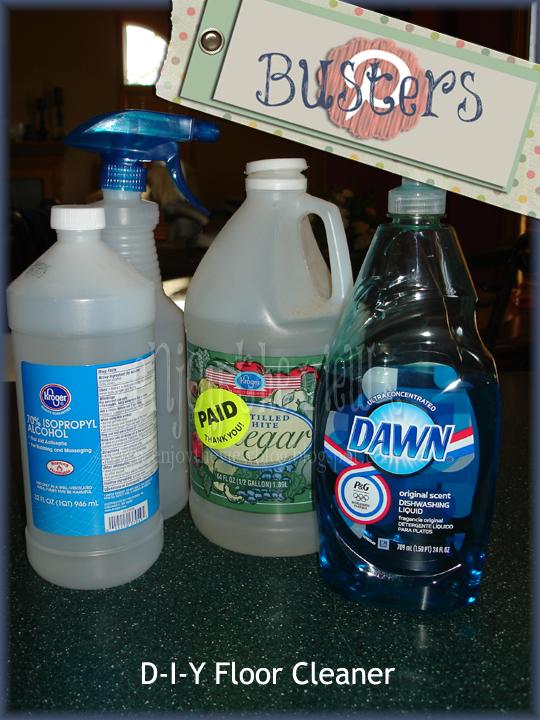
This screenshot has width=540, height=720. In order to click on monitor in this screenshot , I will do click(x=29, y=189).